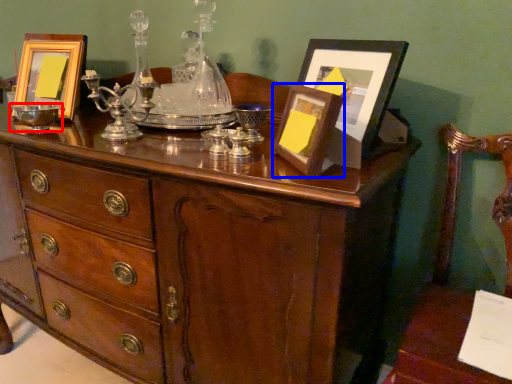
Question: Which point is further to the camera, glass bowl (highlighted by a red box) or picture frame (highlighted by a blue box)?

Choices:
 (A) glass bowl
 (B) picture frame

Answer: (A)